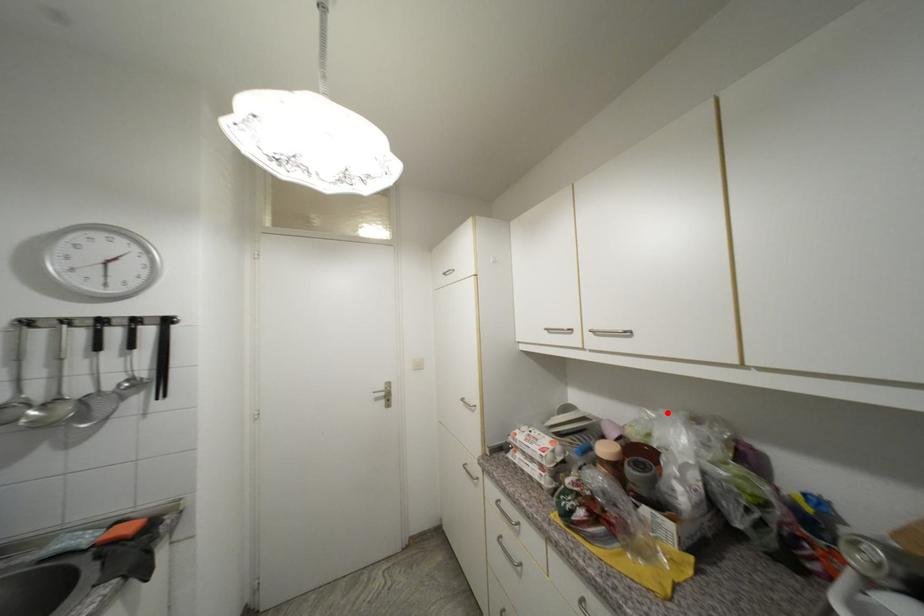
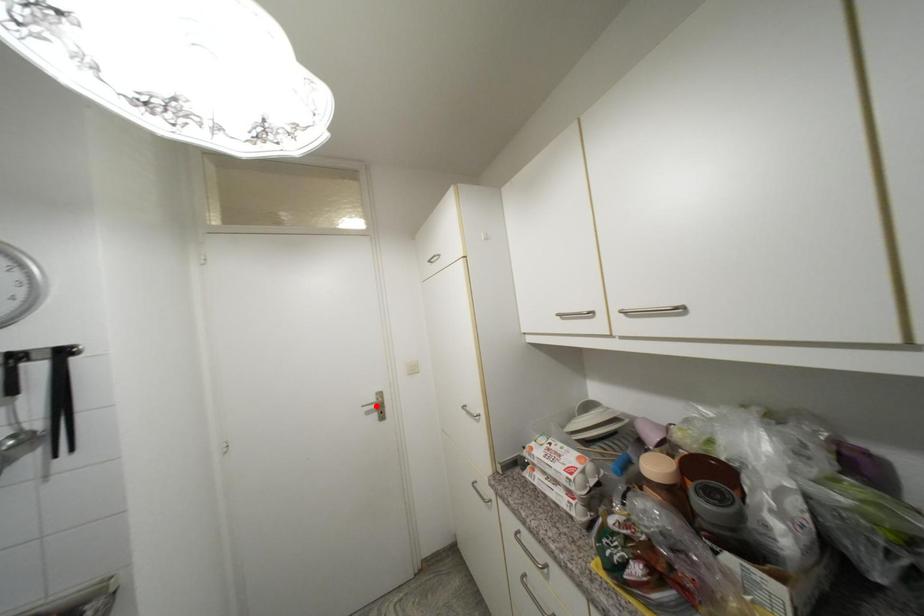
I am providing you with two images of the same scene from different viewpoints. A red point is marked on the first image and another point is marked on the second image. Is the marked point in image1 the same physical position as the marked point in image2?

No